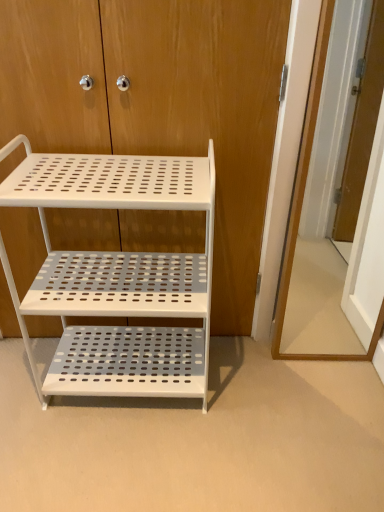
At what (x,y) coordinates should I click in order to perform the action: click on free space on the front side of white perforated metal shelf at center. Please return your answer as a coordinate pair (x, y). The image size is (384, 512). Looking at the image, I should click on (120, 459).